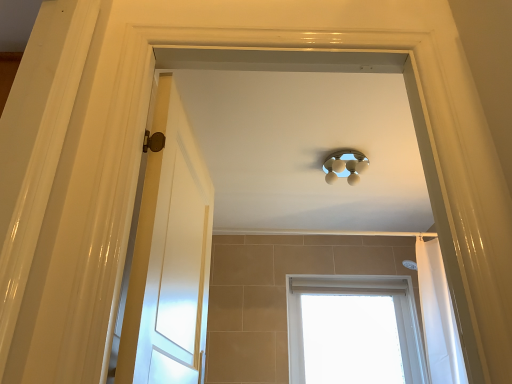
Question: Looking at the image, does white wooden door at left seem bigger or smaller compared to white fabric shower curtain at right?

Choices:
 (A) big
 (B) small

Answer: (B)

Question: From a real-world perspective, relative to white fabric shower curtain at right, is white wooden door at left vertically above or below?

Choices:
 (A) above
 (B) below

Answer: (B)

Question: Which of these objects is positioned closest to the white wooden door at left?

Choices:
 (A) white fabric shower curtain at right
 (B) white plastic window at lower center
 (C) satin silver light fixture at center

Answer: (C)

Question: Based on their relative distances, which object is nearer to the white plastic window at lower center?

Choices:
 (A) white fabric shower curtain at right
 (B) white wooden door at left
 (C) satin silver light fixture at center

Answer: (A)